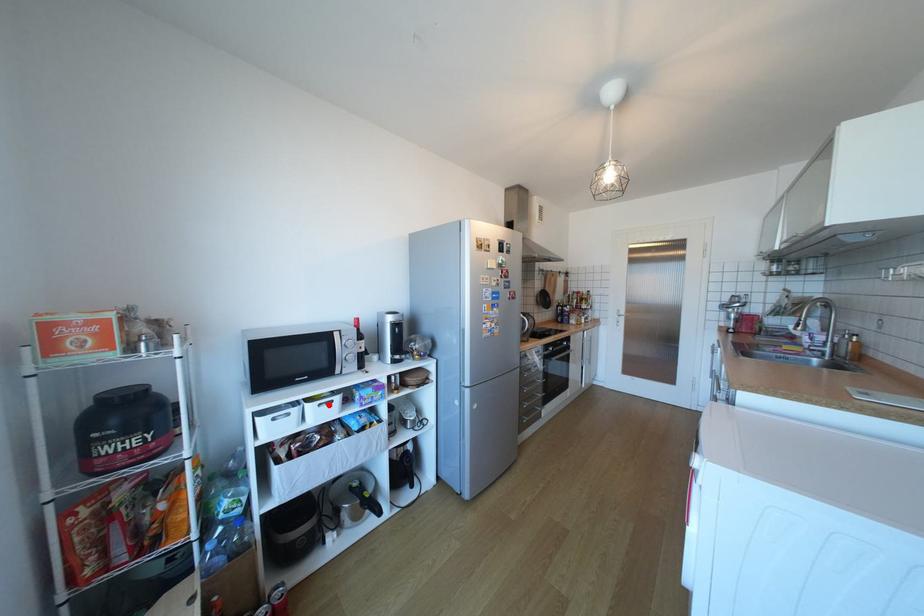
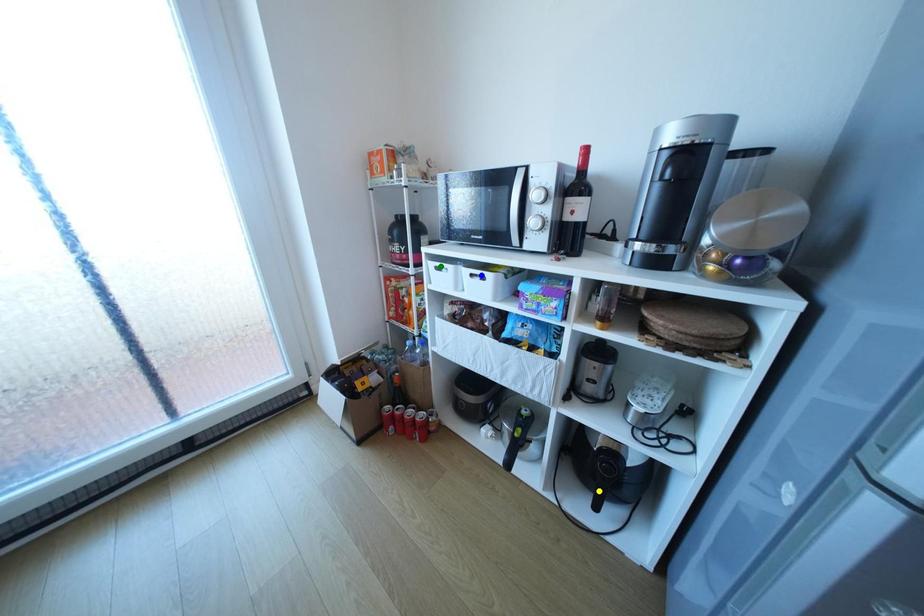
Question: I am providing you with two images of the same scene from different viewpoints. A red point is marked on the first image. You are given multiple points on the second image. In image 2, which mark is for the same physical point as the one in image 1?

Choices:
 (A) green point
 (B) yellow point
 (C) blue point

Answer: (C)